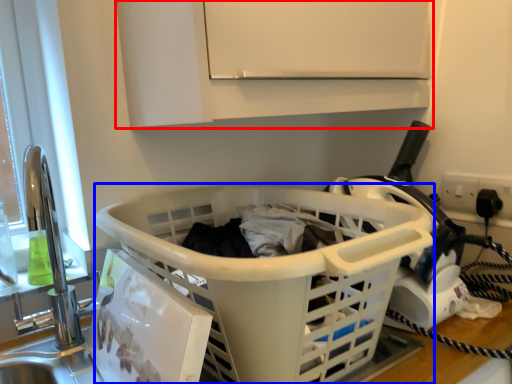
Question: Which object appears closest to the camera in this image, cabinetry (highlighted by a red box) or basket (highlighted by a blue box)?

Choices:
 (A) cabinetry
 (B) basket

Answer: (B)